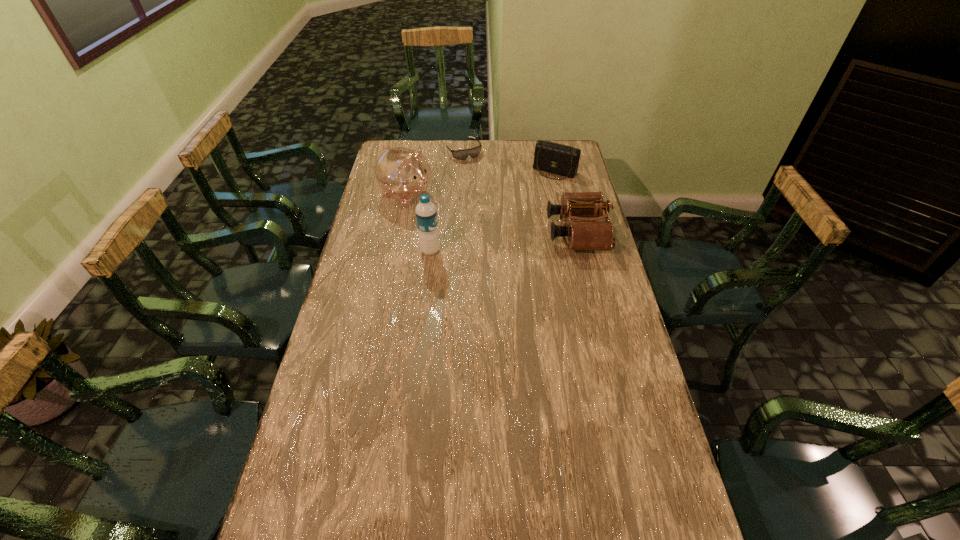
The height and width of the screenshot is (540, 960). In order to click on free space on the desktop that is between the water bottle and the third tallest object and is positioned on the front flap of the clutch bag in this screenshot , I will do `click(510, 241)`.

Image resolution: width=960 pixels, height=540 pixels. In order to click on free space on the desktop that is between the water bottle and the binoculars and is positioned on the front facing side of the piggy bank in this screenshot , I will do `click(498, 242)`.

Identify the location of vacant spot on the desktop that is between the water bottle and the binoculars and is positioned on the lenses of the goggles. The width and height of the screenshot is (960, 540). (524, 239).